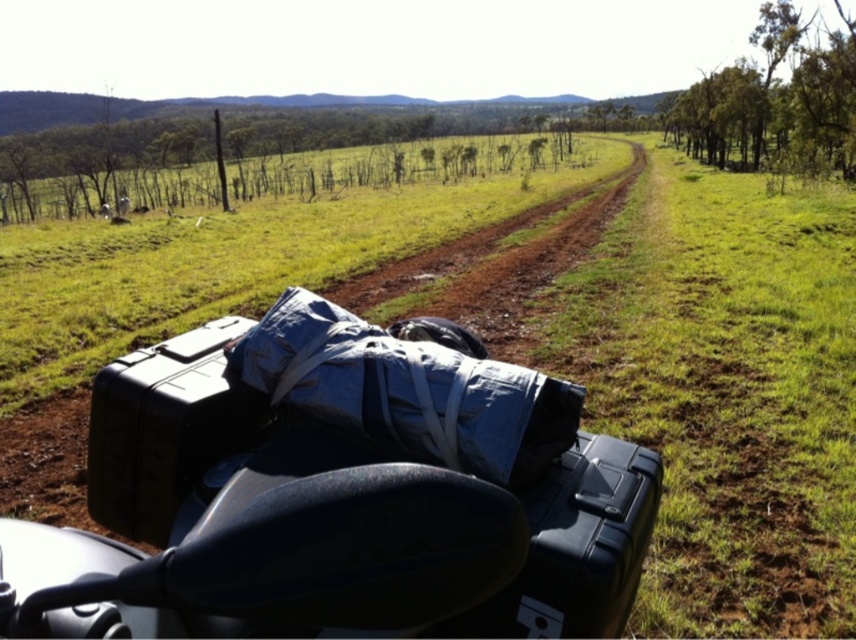
You are driving an ATV and need to navigate a narrow path. You see the brown dirt track at center and the black hard case at lower right. Which one is wider?

The brown dirt track at center is wider than the black hard case at lower right, so the dirt track can accommodate the ATV more easily.

You are riding an ATV and want to place a small backpack on the ground near the black hard case at lower right. Can you confirm if the backpack will be visible from the front seat of the ATV, considering the brown dirt track at center might block the view?

The black hard case at lower right is behind the brown dirt track at center, so placing the backpack near it would mean it is hidden from view by the dirt track from the front seat of the ATV.